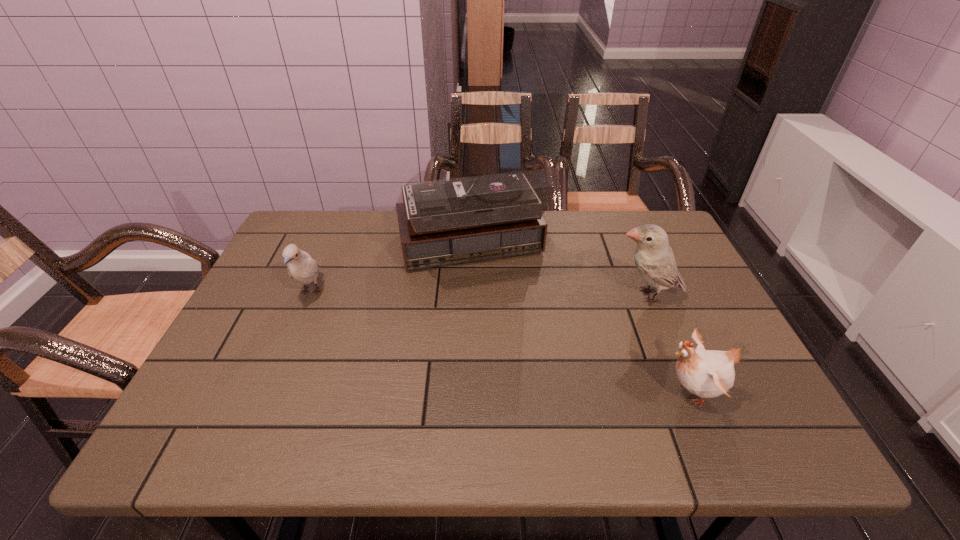
Where is `free space between the record player and the nearest bird`? This screenshot has height=540, width=960. free space between the record player and the nearest bird is located at coordinates (581, 322).

The height and width of the screenshot is (540, 960). I want to click on vacant area between the nearest object and the leftmost object, so click(501, 342).

At what (x,y) coordinates should I click in order to perform the action: click on vacant point located between the nearest bird and the record player. Please return your answer as a coordinate pair (x, y). Looking at the image, I should click on (581, 322).

Select which object is the closest to the nearest bird. Please provide its 2D coordinates. Your answer should be formatted as a tuple, i.e. [(x, y)], where the tuple contains the x and y coordinates of a point satisfying the conditions above.

[(654, 259)]

Identify the location of object that stands as the second closest to the second tallest object. (706, 373).

At what (x,y) coordinates should I click in order to perform the action: click on bird that is the closest one to the second tallest object. Please return your answer as a coordinate pair (x, y). This screenshot has height=540, width=960. Looking at the image, I should click on pos(706,373).

I want to click on bird that can be found as the second closest to the nearest bird, so pyautogui.click(x=301, y=267).